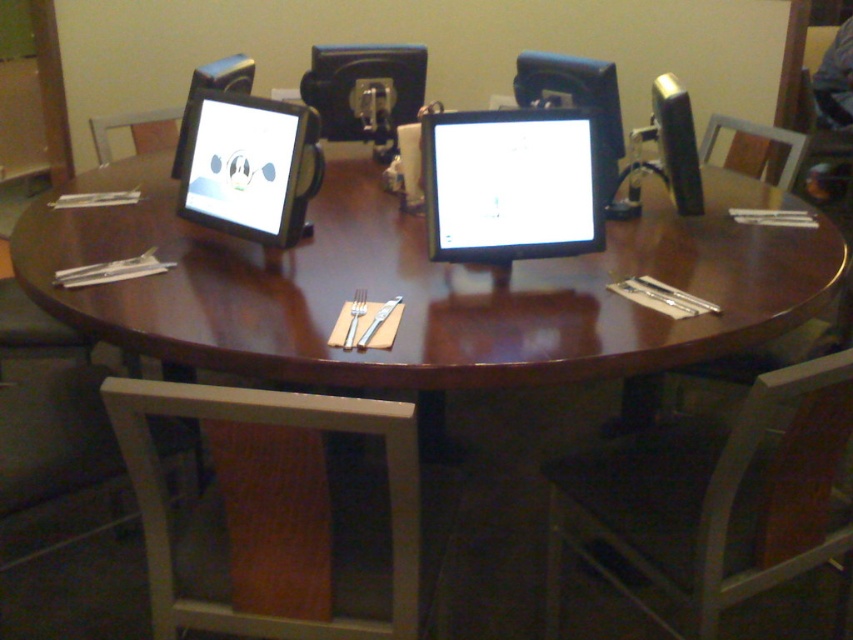
Question: Does white glossy monitor at center have a greater width compared to wooden chair at upper left?

Choices:
 (A) no
 (B) yes

Answer: (B)

Question: Which object appears closest to the camera in this image?

Choices:
 (A) matte black monitor at center
 (B) brown leather swivel chair at lower right

Answer: (B)

Question: Is brown leather swivel chair at lower right wider than white glossy monitor at center?

Choices:
 (A) yes
 (B) no

Answer: (A)

Question: Is brown leather swivel chair at lower right closer to camera compared to white plastic swivel chair at lower left?

Choices:
 (A) no
 (B) yes

Answer: (A)

Question: Among these objects, which one is nearest to the camera?

Choices:
 (A) matte black monitor at center
 (B) wooden chair at upper right
 (C) white glossy monitor at center
 (D) brown leather swivel chair at lower right

Answer: (D)

Question: Which of the following is the farthest from the observer?

Choices:
 (A) wooden chair at upper right
 (B) white glossy monitor at center
 (C) white plastic swivel chair at lower left
 (D) brown leather swivel chair at lower right

Answer: (A)